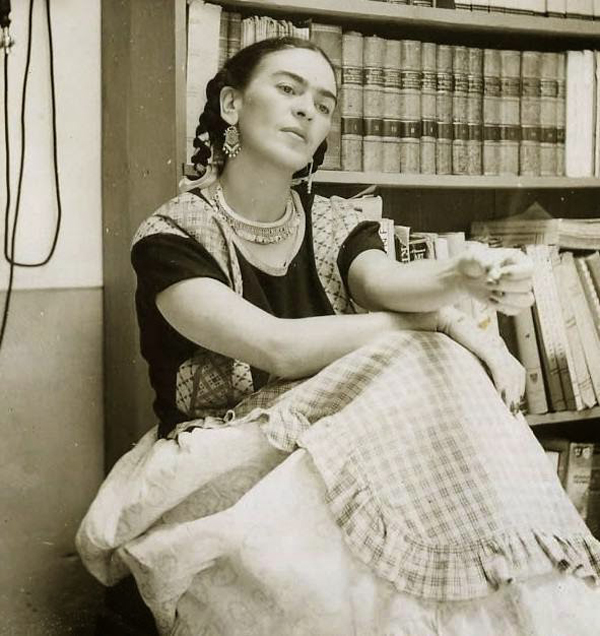
At what (x,y) coordinates should I click in order to perform the action: click on plaid fabric. Please return your answer as a coordinate pair (x, y). Looking at the image, I should click on (194, 219), (150, 223), (323, 257), (184, 385), (210, 385), (244, 385), (349, 392), (443, 582).